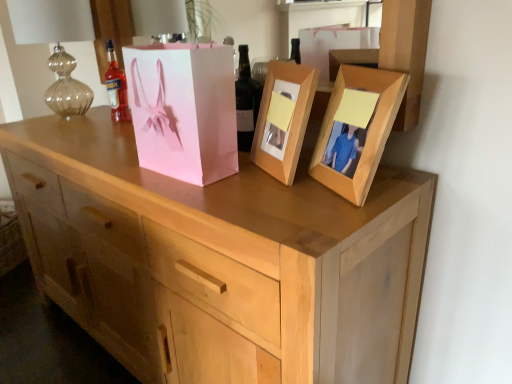
Question: Should I look upward or downward to see translucent glass bottle at upper left, which is the second bottle from front to back?

Choices:
 (A) up
 (B) down

Answer: (A)

Question: Is the depth of wooden photo frame at center, which is the 1th picture frame from left to right, less than that of dark brown glass bottle at center, marked as the second bottle in a back-to-front arrangement?

Choices:
 (A) no
 (B) yes

Answer: (B)

Question: Is wooden photo frame at center, the second picture frame viewed from the right, at the right side of dark brown glass bottle at center, acting as the 1th bottle starting from the front?

Choices:
 (A) no
 (B) yes

Answer: (B)

Question: Does wooden photo frame at center, the second picture frame viewed from the right, have a smaller size compared to dark brown glass bottle at center, marked as the second bottle in a back-to-front arrangement?

Choices:
 (A) no
 (B) yes

Answer: (A)

Question: Can you confirm if wooden photo frame at center, which is the 1th picture frame from left to right, is wider than dark brown glass bottle at center, the 2th bottle when ordered from left to right?

Choices:
 (A) no
 (B) yes

Answer: (B)

Question: From a real-world perspective, is wooden photo frame at center, the second picture frame viewed from the right, over dark brown glass bottle at center, marked as the second bottle in a back-to-front arrangement?

Choices:
 (A) no
 (B) yes

Answer: (A)

Question: From the image's perspective, is dark brown glass bottle at center, the 2th bottle when ordered from left to right, under pink paper bag at center?

Choices:
 (A) yes
 (B) no

Answer: (B)

Question: Is dark brown glass bottle at center, the 2th bottle when ordered from left to right, oriented away from pink paper bag at center?

Choices:
 (A) yes
 (B) no

Answer: (B)

Question: Is dark brown glass bottle at center, acting as the 1th bottle starting from the front, not close to pink paper bag at center?

Choices:
 (A) yes
 (B) no

Answer: (B)

Question: Is dark brown glass bottle at center, acting as the 1th bottle starting from the front, positioned beyond the bounds of pink paper bag at center?

Choices:
 (A) no
 (B) yes

Answer: (B)

Question: Can you confirm if dark brown glass bottle at center, acting as the 1th bottle starting from the front, is bigger than pink paper bag at center?

Choices:
 (A) yes
 (B) no

Answer: (B)

Question: Does dark brown glass bottle at center, the 1th bottle positioned from the right, have a greater width compared to pink paper bag at center?

Choices:
 (A) no
 (B) yes

Answer: (A)

Question: Does light wood chest of drawers at center appear on the right side of wooden photo frame at upper right, which is the second picture frame from left to right?

Choices:
 (A) yes
 (B) no

Answer: (B)